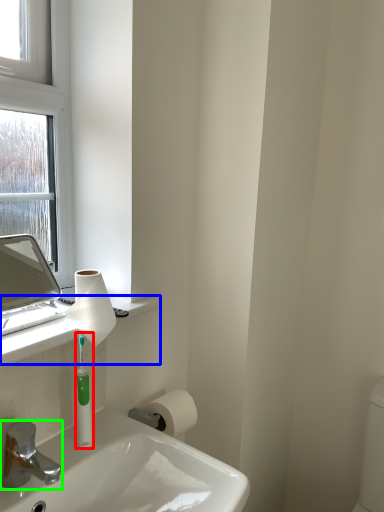
Question: Estimate the real-world distances between objects in this image. Which object is farther from mouthwash (highlighted by a red box), counter top (highlighted by a blue box) or tap (highlighted by a green box)?

Choices:
 (A) counter top
 (B) tap

Answer: (B)